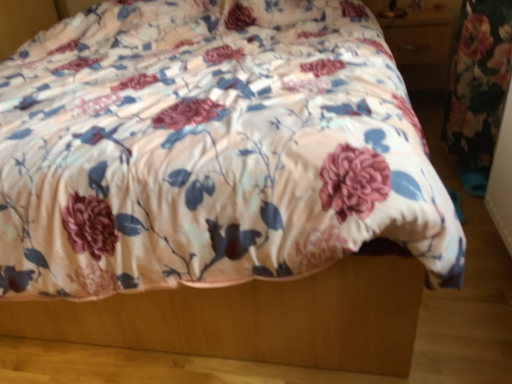
Question: Which is correct: floral fabric bed at center is inside wooden drawer at upper right, or outside of it?

Choices:
 (A) outside
 (B) inside

Answer: (A)

Question: From their relative heights in the image, would you say floral fabric bed at center is taller or shorter than wooden drawer at upper right?

Choices:
 (A) tall
 (B) short

Answer: (A)

Question: Relative to wooden drawer at upper right, is floral fabric bed at center in front or behind?

Choices:
 (A) front
 (B) behind

Answer: (A)

Question: From a real-world perspective, is wooden drawer at upper right positioned above or below floral fabric bed at center?

Choices:
 (A) above
 (B) below

Answer: (A)

Question: Relative to floral fabric bed at center, is wooden drawer at upper right in front or behind?

Choices:
 (A) front
 (B) behind

Answer: (B)

Question: From their relative heights in the image, would you say wooden drawer at upper right is taller or shorter than floral fabric bed at center?

Choices:
 (A) short
 (B) tall

Answer: (A)

Question: In terms of size, does wooden drawer at upper right appear bigger or smaller than floral fabric bed at center?

Choices:
 (A) big
 (B) small

Answer: (B)